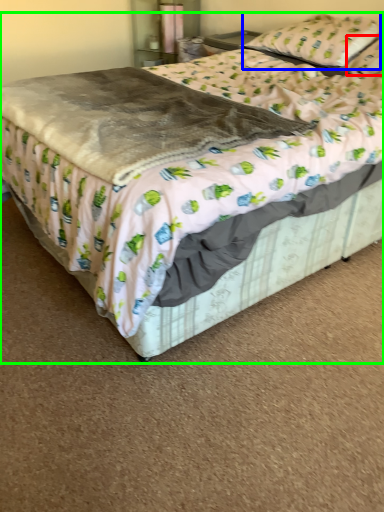
Question: Estimate the real-world distances between objects in this image. Which object is closer to pillow (highlighted by a red box), pillow (highlighted by a blue box) or bed (highlighted by a green box)?

Choices:
 (A) pillow
 (B) bed

Answer: (A)